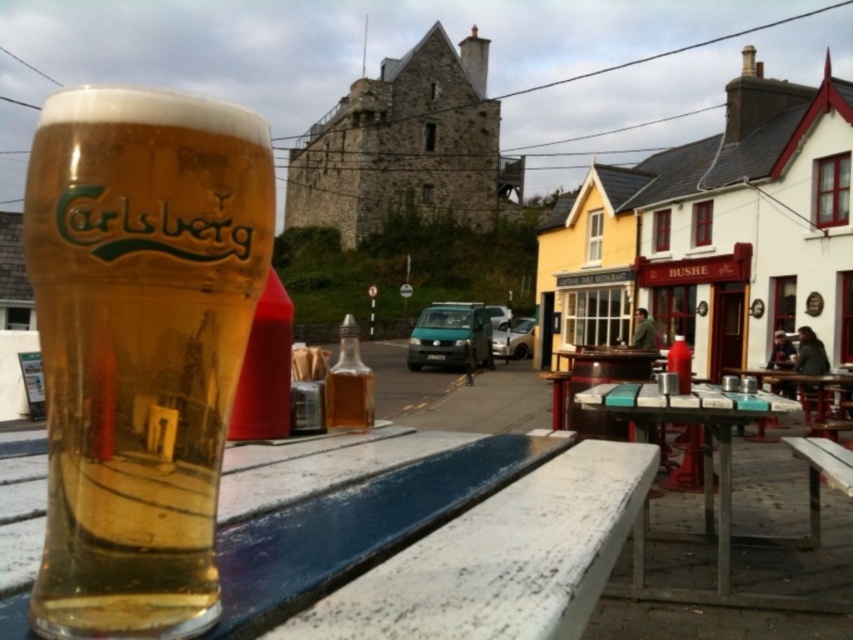
Question: Is white painted wood table at lower center to the left of translucent glass bottle at center from the viewer's perspective?

Choices:
 (A) yes
 (B) no

Answer: (B)

Question: Can you confirm if golden glass carlsberg at left is positioned to the right of white marble table at center?

Choices:
 (A) yes
 (B) no

Answer: (B)

Question: Considering the real-world distances, which object is farthest from the white marble table at center?

Choices:
 (A) golden glass carlsberg at left
 (B) white painted wood table at lower center

Answer: (A)

Question: Considering the real-world distances, which object is closest to the white painted wood table at lower center?

Choices:
 (A) golden glass carlsberg at left
 (B) translucent glass bottle at center
 (C) white marble table at center

Answer: (A)

Question: Does white painted wood table at lower center come in front of white marble table at center?

Choices:
 (A) yes
 (B) no

Answer: (A)

Question: Among these objects, which one is nearest to the camera?

Choices:
 (A) golden glass carlsberg at left
 (B) white marble table at center

Answer: (A)